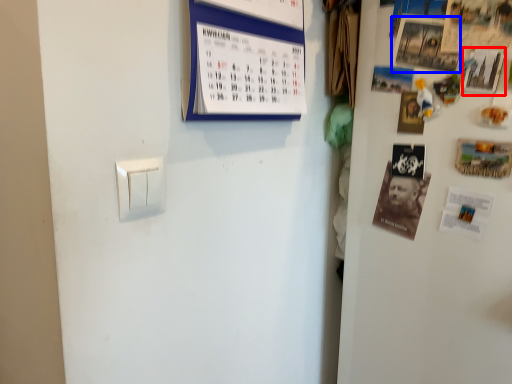
Question: Which object is further to the camera taking this photo, poster (highlighted by a red box) or poster (highlighted by a blue box)?

Choices:
 (A) poster
 (B) poster

Answer: (B)